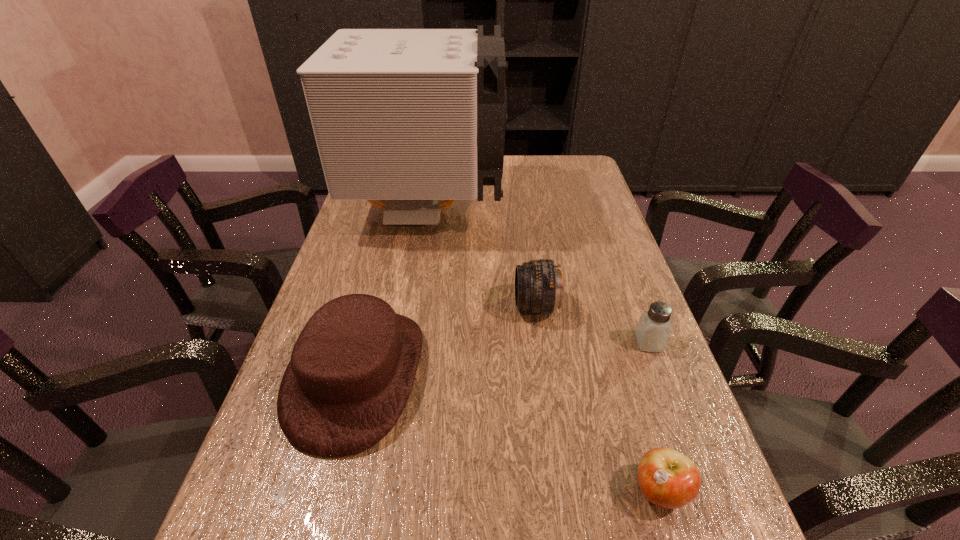
Locate an element on the screen. the tallest object is located at coordinates (413, 116).

Locate an element on the screen. The height and width of the screenshot is (540, 960). fan is located at coordinates (413, 116).

Find the location of a particular element. The height and width of the screenshot is (540, 960). hat is located at coordinates pyautogui.click(x=352, y=368).

Locate an element on the screen. The image size is (960, 540). telephoto lens is located at coordinates (538, 283).

This screenshot has height=540, width=960. Find the location of `the fourth tallest object`. the fourth tallest object is located at coordinates (653, 330).

Identify the location of apple. This screenshot has height=540, width=960. (667, 478).

Where is `the shortest object`? This screenshot has width=960, height=540. the shortest object is located at coordinates (667, 478).

Locate an element on the screen. The height and width of the screenshot is (540, 960). vacant space located on the back of the farthest object is located at coordinates (435, 166).

Identify the location of vacant space situated on the back of the hat. (389, 249).

The width and height of the screenshot is (960, 540). What are the coordinates of `vacant area situated 0.400m at the front element of the third object from left to right` in the screenshot? It's located at (344, 306).